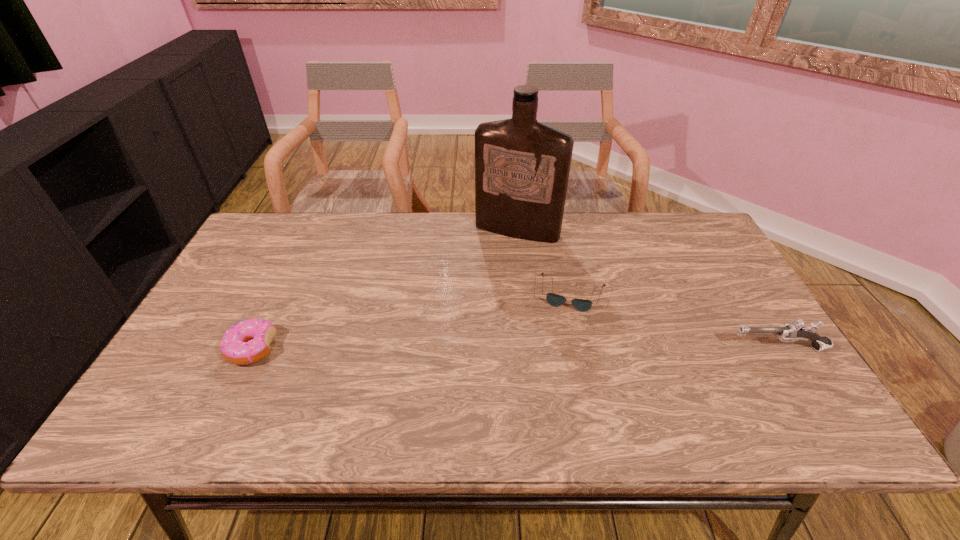
I want to click on object located at the left edge, so click(x=247, y=342).

You are a GUI agent. You are given a task and a screenshot of the screen. Output one action in this format:
    pyautogui.click(x=<x>, y=<y>)
    Task: Click on the object positioned at the right edge
    The height and width of the screenshot is (540, 960).
    Given the screenshot: What is the action you would take?
    pyautogui.click(x=794, y=331)

The height and width of the screenshot is (540, 960). Find the location of `object at the near left corner`. object at the near left corner is located at coordinates (247, 342).

At what (x,y) coordinates should I click in order to perform the action: click on free space at the far edge. Please return your answer as a coordinate pair (x, y). The width and height of the screenshot is (960, 540). Looking at the image, I should click on (367, 249).

The width and height of the screenshot is (960, 540). Find the location of `free region at the near edge of the desktop`. free region at the near edge of the desktop is located at coordinates 339,382.

Locate an element on the screen. The image size is (960, 540). vacant region at the right edge of the desktop is located at coordinates (727, 337).

In the image, there is a desktop. Find the location of `blank space at the far left corner`. blank space at the far left corner is located at coordinates (298, 222).

Where is `vacant region at the near left corner of the desktop`? vacant region at the near left corner of the desktop is located at coordinates (180, 387).

Identify the location of vacant space at the far right corner of the desktop. This screenshot has height=540, width=960. (682, 220).

In the image, there is a desktop. Find the location of `vacant space at the near right corner`. vacant space at the near right corner is located at coordinates (737, 382).